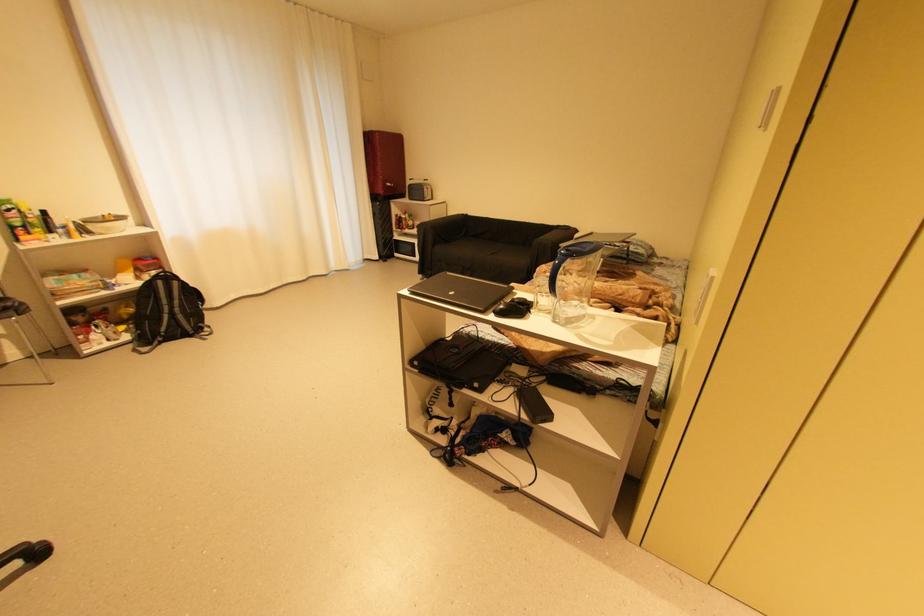
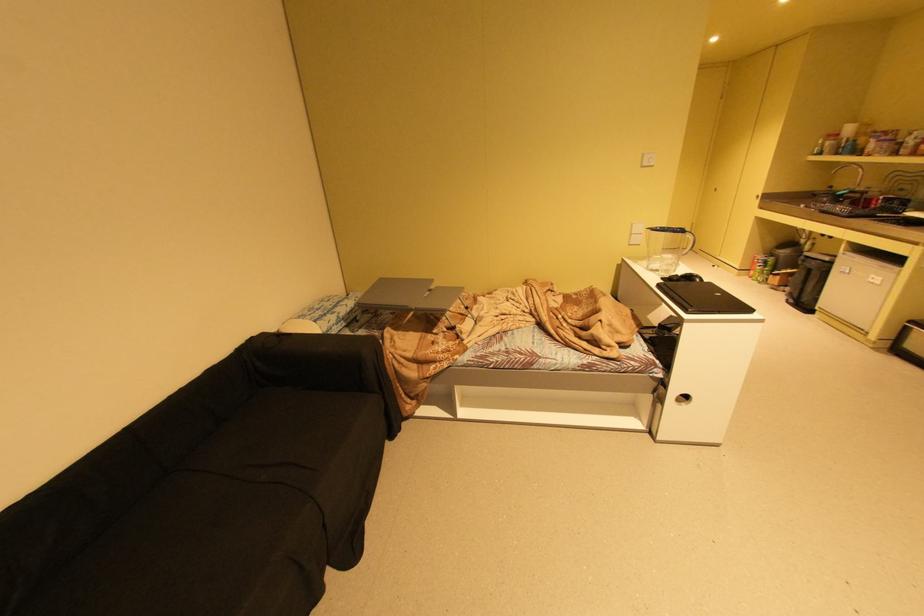
In the second image, find the point that corresponds to [459,293] in the first image.

(726, 294)